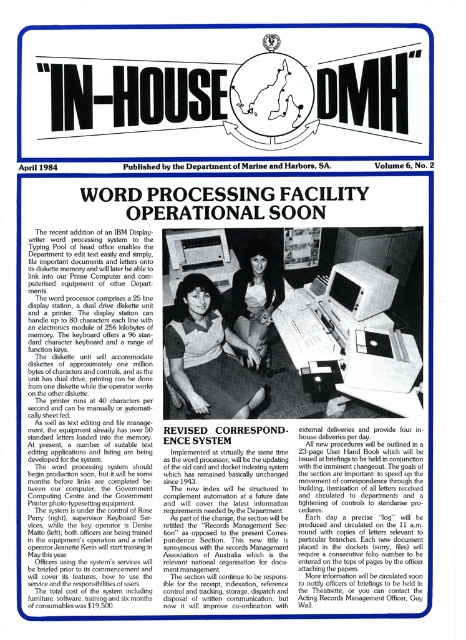
Question: Which of the following is the farthest from the observer?

Choices:
 (A) (232, 292)
 (B) (391, 284)
 (C) (192, 339)

Answer: (A)

Question: Which point is farther to the camera?

Choices:
 (A) white fabric-covered computer at center
 (B) matte black hair at center

Answer: (B)

Question: Is matte black hair at center smaller than white fabric-covered computer at center?

Choices:
 (A) no
 (B) yes

Answer: (A)

Question: Does matte black hair at center appear on the right side of white fabric-covered computer at center?

Choices:
 (A) yes
 (B) no

Answer: (B)

Question: Can you confirm if matte black shirt at center is bigger than matte black hair at center?

Choices:
 (A) no
 (B) yes

Answer: (B)

Question: Which point is closer to the camera?

Choices:
 (A) 217,417
 (B) 370,307
 (C) 246,308

Answer: (A)